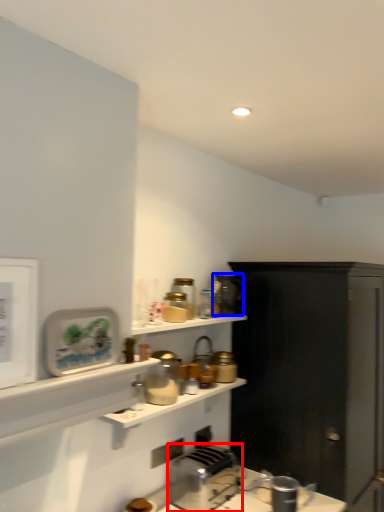
Question: Which of the following is the closest to the observer, toaster (highlighted by a red box) or appliance (highlighted by a blue box)?

Choices:
 (A) toaster
 (B) appliance

Answer: (A)